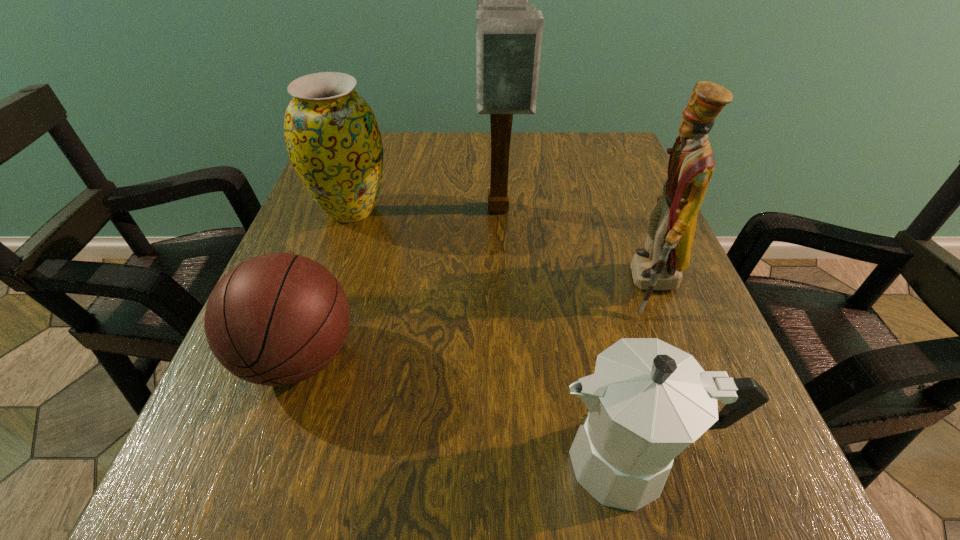
The width and height of the screenshot is (960, 540). Identify the location of free space that satisfies the following two spatial constraints: 1. on the front-facing side of the nutcracker; 2. on the front side of the shortest object. (679, 357).